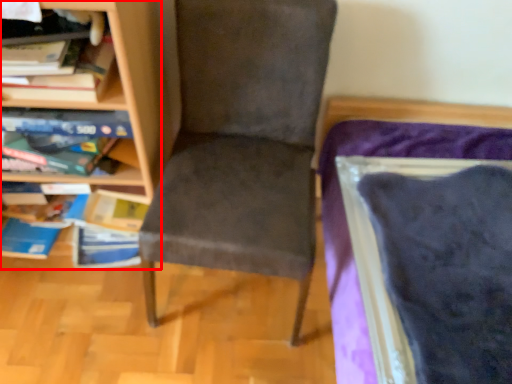
Question: Considering the relative positions of bookcase (annotated by the red box) and chair in the image provided, where is bookcase (annotated by the red box) located with respect to the staircase?

Choices:
 (A) right
 (B) left

Answer: (B)